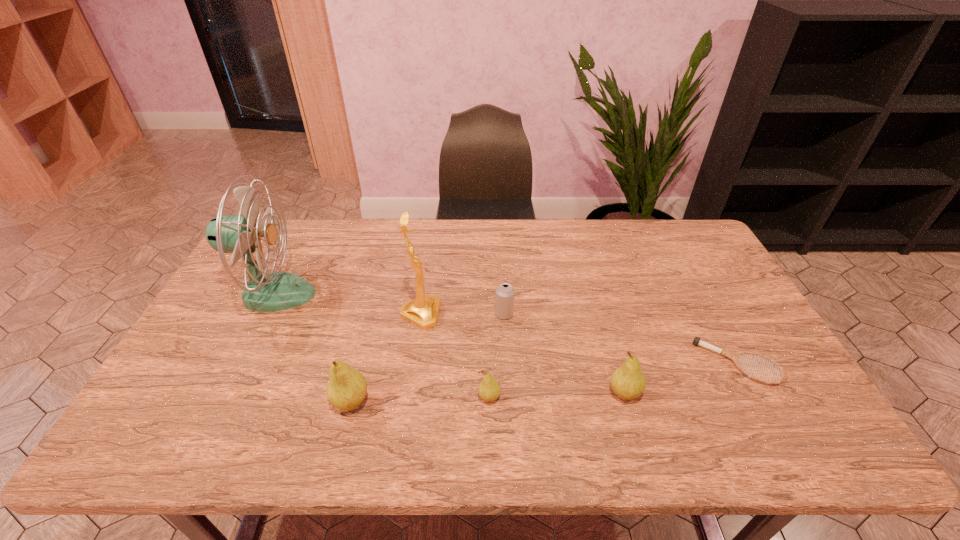
The height and width of the screenshot is (540, 960). Identify the location of vacant space located on the back of the shortest pear. (489, 357).

I want to click on free space located 0.210m on the left of the second shortest pear, so [523, 394].

Find the location of `vacant space located 0.170m on the right of the beer can`. vacant space located 0.170m on the right of the beer can is located at coordinates (571, 314).

Locate an element on the screen. free location located 0.350m on the back of the tennis racket is located at coordinates (682, 261).

Find the location of a particular element. The image size is (960, 540). free region located 0.380m in front of the fan, directing airflow is located at coordinates (439, 294).

Where is `blank space located on the front-facing side of the third object from left to right`? Image resolution: width=960 pixels, height=540 pixels. blank space located on the front-facing side of the third object from left to right is located at coordinates (560, 315).

Locate an element on the screen. This screenshot has height=540, width=960. tennis racket that is at the near edge is located at coordinates (733, 356).

This screenshot has height=540, width=960. Find the location of `object that is at the left edge`. object that is at the left edge is located at coordinates (265, 291).

Where is `object situated at the right edge`? This screenshot has width=960, height=540. object situated at the right edge is located at coordinates (733, 356).

The image size is (960, 540). I want to click on object at the near right corner, so click(733, 356).